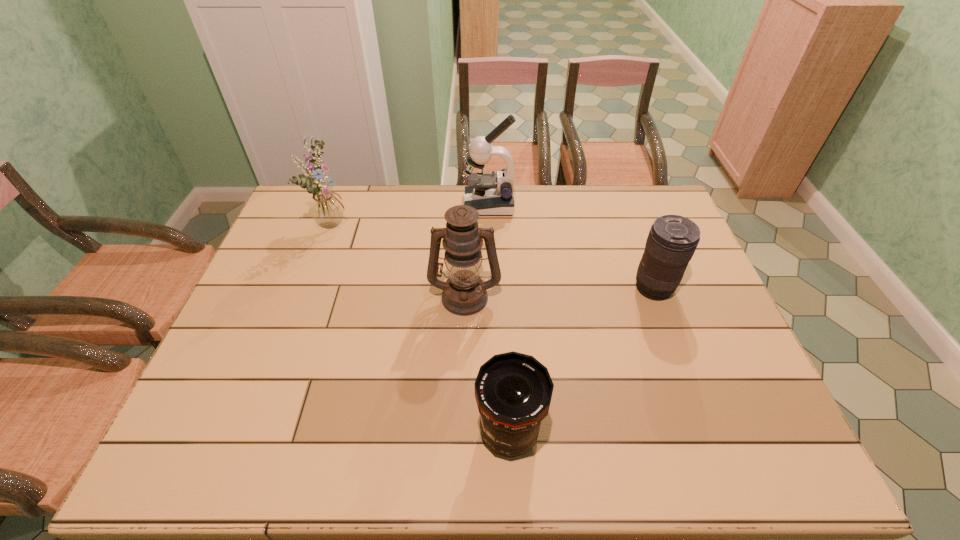
Find the location of a particular element. The image size is (960, 540). microscope is located at coordinates (491, 193).

This screenshot has height=540, width=960. In order to click on oil lamp in this screenshot , I will do `click(464, 293)`.

Identify the location of the leftmost object. (326, 208).

This screenshot has width=960, height=540. Identify the location of the farther telephoto lens. (672, 240).

The image size is (960, 540). In order to click on the rightmost object in this screenshot , I will do `click(672, 240)`.

In order to click on the nearer telephoto lens in this screenshot , I will do `click(513, 391)`.

This screenshot has width=960, height=540. I want to click on the nearest object, so click(x=513, y=391).

The image size is (960, 540). Find the location of `vacant space situated on the front of the microscope`. vacant space situated on the front of the microscope is located at coordinates (491, 246).

Find the location of `vacant area situated on the back of the oil lamp`. vacant area situated on the back of the oil lamp is located at coordinates (467, 244).

Where is `vacant area located on the front-facing side of the leftmost object`? Image resolution: width=960 pixels, height=540 pixels. vacant area located on the front-facing side of the leftmost object is located at coordinates (386, 223).